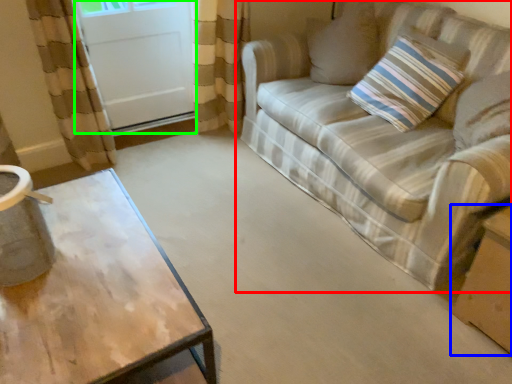
Question: Which is nearer to the studio couch (highlighted by a red box)? cardboard box (highlighted by a blue box) or screen door (highlighted by a green box).

Choices:
 (A) cardboard box
 (B) screen door

Answer: (A)